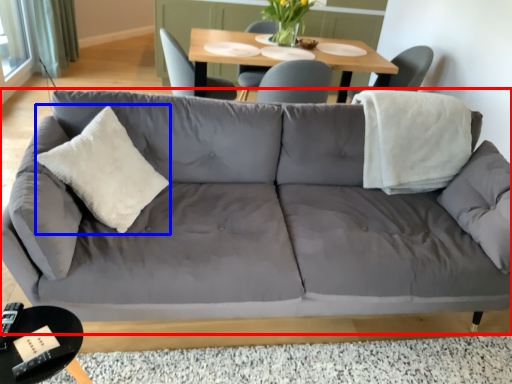
Question: Which of the following is the closest to the observer, studio couch (highlighted by a red box) or throw pillow (highlighted by a blue box)?

Choices:
 (A) studio couch
 (B) throw pillow

Answer: (A)